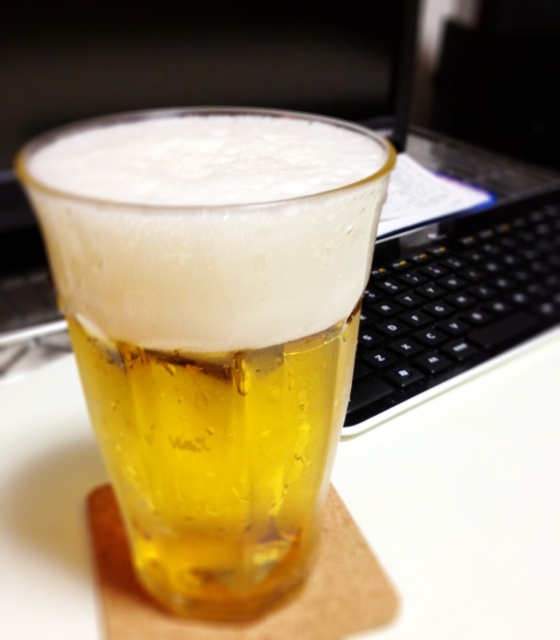
You are a bartender who needs to place a coaster exactly at the center of the table. The table is a square table with coordinates from 0 to 1 on both axes. The translucent glass at center is currently at point 0.514, 0.380. Where should you place the coaster so that it is exactly at the center of the table?

The center of the table is at point [280,320]. Since the translucent glass at center is at [212,328], you should move it to [280,320] to be exactly at the center.

You are setting up a small table for a virtual meeting. You have a translucent glass at center and a black plastic keyboard at right. Since space is limited, you need to know which item takes up more vertical space. Which one is taller?

The translucent glass at center is taller than the black plastic keyboard at right according to the description.

You are a photographer setting up a shot of the translucent glass at center and the black plastic keyboard at right. To ensure both are in focus, you need to adjust the depth of field. Which object should you focus on to make sure both are sharp?

You should focus on the translucent glass at center because it is closer to the viewer than the black plastic keyboard at right, so focusing on the closer object will ensure the background object is also in focus.